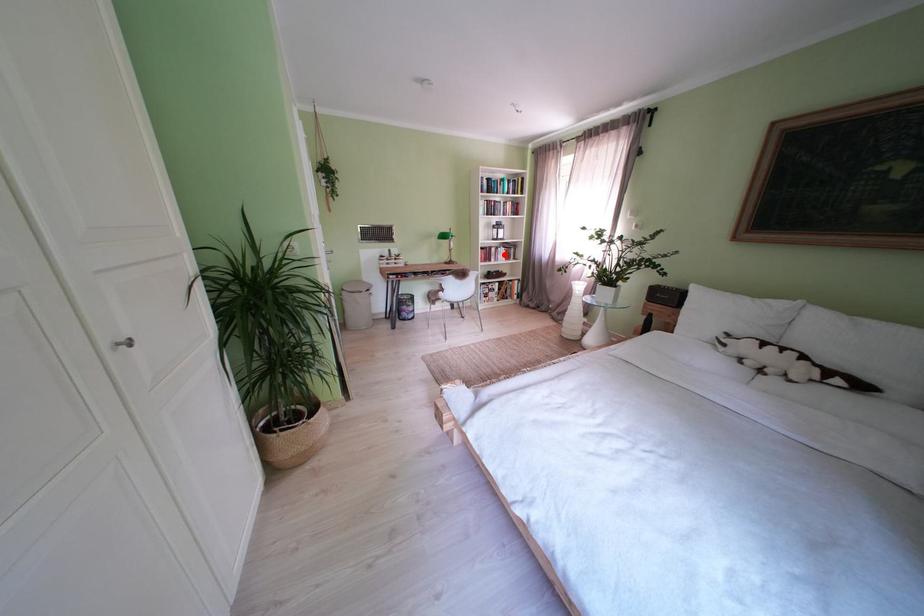
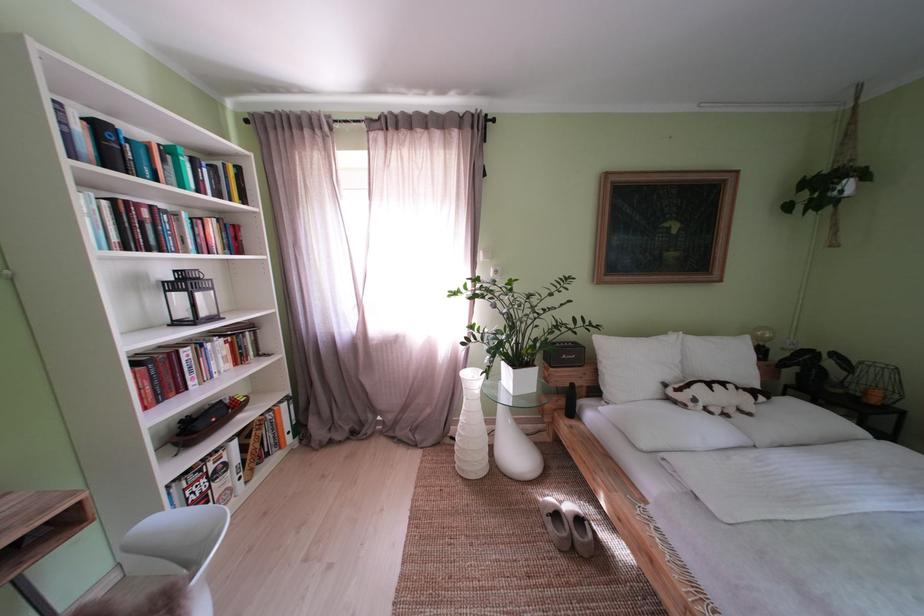
Locate, in the second image, the point that corresponds to the highlighted location in the first image.

(199, 359)